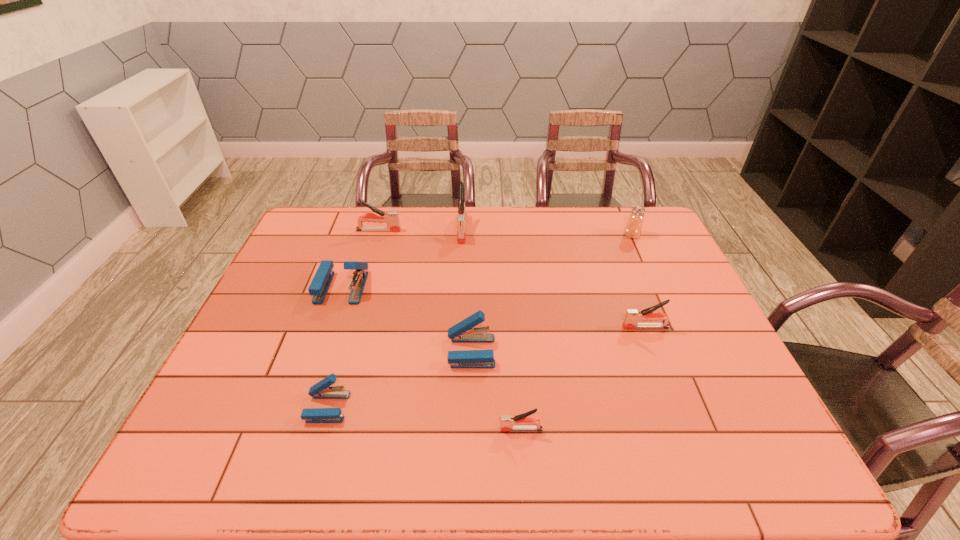
Locate which stapler is the fourth closest to the fifth nearest stapler. Please provide its 2D coordinates. Your answer should be formatted as a tuple, i.e. [(x, y)], where the tuple contains the x and y coordinates of a point satisfying the conditions above.

[(461, 237)]

Select which gray stapler is the third closest to the smallest gray stapler. Please provide its 2D coordinates. Your answer should be formatted as a tuple, i.e. [(x, y)], where the tuple contains the x and y coordinates of a point satisfying the conditions above.

[(391, 218)]

This screenshot has height=540, width=960. Identify the location of gray stapler that is the third closest to the sixth object from left to right. (391, 218).

You are a GUI agent. You are given a task and a screenshot of the screen. Output one action in this format:
    pyautogui.click(x=<x>, y=<y>)
    Task: Click on the second closest blue stapler to the nearest blue stapler
    Image resolution: width=960 pixels, height=540 pixels.
    Given the screenshot: What is the action you would take?
    pyautogui.click(x=320, y=284)

Identify the location of the second closest blue stapler to the third farthest stapler. (322, 390).

The height and width of the screenshot is (540, 960). I want to click on free space in the image that satisfies the following two spatial constraints: 1. on the handle side of the third smallest gray stapler; 2. on the back side of the seventh farthest object, so click(325, 407).

Identify the location of vacant space that satisfies the following two spatial constraints: 1. on the handle side of the second biggest gray stapler; 2. on the left side of the saltshaker. (377, 235).